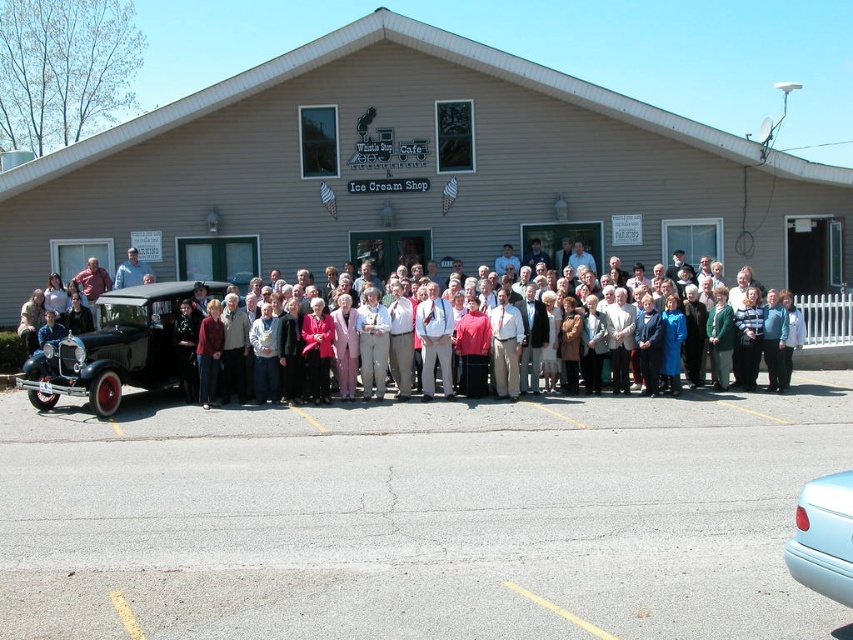
Question: Can you confirm if beige siding building at center is thinner than shiny black car at left?

Choices:
 (A) yes
 (B) no

Answer: (B)

Question: Is shiny black car at left below light blue glossy car at lower right?

Choices:
 (A) no
 (B) yes

Answer: (A)

Question: Which of the following is the farthest from the observer?

Choices:
 (A) (399, 104)
 (B) (845, 525)
 (C) (180, 243)
 (D) (165, 307)

Answer: (C)

Question: Is shiny black car at left above matte pink sweater at center?

Choices:
 (A) no
 (B) yes

Answer: (A)

Question: Among these objects, which one is nearest to the camera?

Choices:
 (A) light blue glossy car at lower right
 (B) beige siding building at center

Answer: (A)

Question: Which point is farther to the camera?

Choices:
 (A) shiny black car at left
 (B) beige siding building at center
 (C) matte pink sweater at center
 (D) light blue glossy car at lower right

Answer: (C)